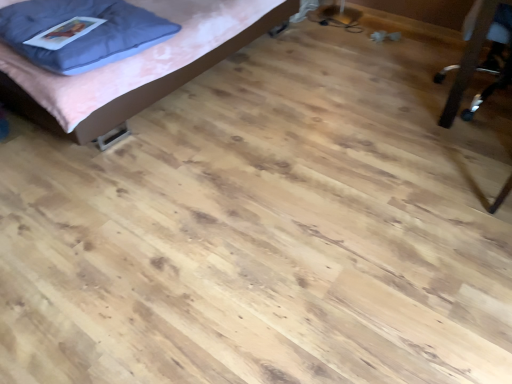
Describe the element at coordinates (469, 59) in the screenshot. I see `metallic silver chair at right` at that location.

Where is `blue fabric pillow at upper left`? This screenshot has width=512, height=384. blue fabric pillow at upper left is located at coordinates (85, 34).

Where is `bed above the metallic silver chair at right (from a real-world perspective)`? bed above the metallic silver chair at right (from a real-world perspective) is located at coordinates (139, 87).

Measure the distance between matte pink bed at upper left and metallic silver chair at right.

1.48 meters.

Which object is wider, matte pink bed at upper left or metallic silver chair at right?

Result: matte pink bed at upper left.

Is matte pink bed at upper left facing away from metallic silver chair at right?

No, matte pink bed at upper left's orientation is not away from metallic silver chair at right.

Considering the positions of points (102, 3) and (452, 122), is point (102, 3) farther from camera compared to point (452, 122)?

No, it is in front of (452, 122).

Is blue fabric pillow at upper left shorter than metallic silver chair at right?

Indeed, blue fabric pillow at upper left has a lesser height compared to metallic silver chair at right.

Considering the relative sizes of blue fabric pillow at upper left and metallic silver chair at right in the image provided, is blue fabric pillow at upper left thinner than metallic silver chair at right?

Correct, the width of blue fabric pillow at upper left is less than that of metallic silver chair at right.

Is blue fabric pillow at upper left surrounding metallic silver chair at right?

No, blue fabric pillow at upper left does not contain metallic silver chair at right.

From a real-world perspective, between metallic silver chair at right and matte pink bed at upper left, who is vertically lower?

In real-world perspective, metallic silver chair at right is lower.

Which point is more distant from viewer, (457, 110) or (118, 122)?

The point (457, 110) is farther.

Does metallic silver chair at right turn towards matte pink bed at upper left?

No, metallic silver chair at right is not aimed at matte pink bed at upper left.

Identify the location of bed lying in front of the metallic silver chair at right. This screenshot has width=512, height=384. (139, 87).

Who is shorter, matte pink bed at upper left or blue fabric pillow at upper left?

blue fabric pillow at upper left is shorter.

Is point (80, 126) closer or farther from the camera than point (148, 32)?

Point (80, 126).

Is matte pink bed at upper left inside or outside of blue fabric pillow at upper left?

The correct answer is: outside.

How far apart are matte pink bed at upper left and blue fabric pillow at upper left?

A distance of 13.64 inches exists between matte pink bed at upper left and blue fabric pillow at upper left.

From the image's perspective, is blue fabric pillow at upper left located above or below matte pink bed at upper left?

Based on their image positions, blue fabric pillow at upper left is located beneath matte pink bed at upper left.

Is blue fabric pillow at upper left oriented away from matte pink bed at upper left?

That's right, blue fabric pillow at upper left is facing away from matte pink bed at upper left.

Find the location of a particular element. pillow behind the matte pink bed at upper left is located at coordinates (85, 34).

Can you confirm if blue fabric pillow at upper left is shorter than matte pink bed at upper left?

Indeed, blue fabric pillow at upper left has a lesser height compared to matte pink bed at upper left.

Would you say metallic silver chair at right is inside or outside blue fabric pillow at upper left?

metallic silver chair at right is not enclosed by blue fabric pillow at upper left.

Measure the distance from metallic silver chair at right to blue fabric pillow at upper left.

metallic silver chair at right and blue fabric pillow at upper left are 1.67 meters apart from each other.

From the image's perspective, is metallic silver chair at right positioned above or below blue fabric pillow at upper left?

metallic silver chair at right is below blue fabric pillow at upper left.

How many degrees apart are the facing directions of metallic silver chair at right and blue fabric pillow at upper left?

The angular difference between metallic silver chair at right and blue fabric pillow at upper left is 86.5 degrees.

Where is `bed that is above the metallic silver chair at right (from the image's perspective)`? Image resolution: width=512 pixels, height=384 pixels. bed that is above the metallic silver chair at right (from the image's perspective) is located at coordinates (139, 87).

Locate an element on the screen. furniture below the blue fabric pillow at upper left (from a real-world perspective) is located at coordinates (469, 59).

Looking at the image, which one is located further to metallic silver chair at right, matte pink bed at upper left or blue fabric pillow at upper left?

Among the two, blue fabric pillow at upper left is located further to metallic silver chair at right.

In the scene shown: Looking at the image, which one is located further to blue fabric pillow at upper left, matte pink bed at upper left or metallic silver chair at right?

metallic silver chair at right.

Which object lies further to the anchor point blue fabric pillow at upper left, metallic silver chair at right or matte pink bed at upper left?

metallic silver chair at right is further to blue fabric pillow at upper left.

From the image, which object appears to be farther from matte pink bed at upper left, metallic silver chair at right or blue fabric pillow at upper left?

The object further to matte pink bed at upper left is metallic silver chair at right.

From the image, which object appears to be nearer to matte pink bed at upper left, blue fabric pillow at upper left or metallic silver chair at right?

blue fabric pillow at upper left is closer to matte pink bed at upper left.

From the image, which object appears to be nearer to metallic silver chair at right, blue fabric pillow at upper left or matte pink bed at upper left?

matte pink bed at upper left is positioned closer to the anchor metallic silver chair at right.

The width and height of the screenshot is (512, 384). I want to click on bed between blue fabric pillow at upper left and metallic silver chair at right, so click(x=139, y=87).